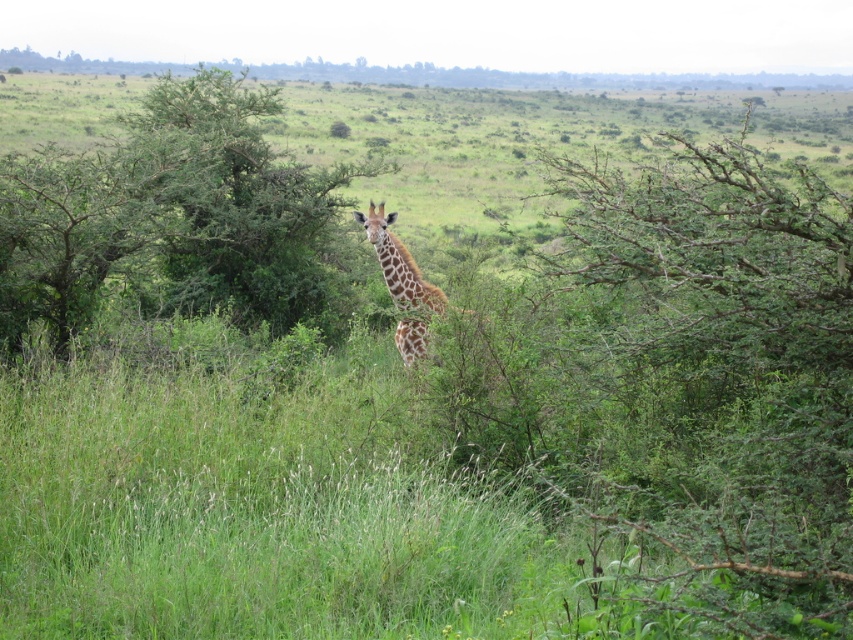
Question: Is green leafy bush at center further to camera compared to green leafy tree at center?

Choices:
 (A) yes
 (B) no

Answer: (B)

Question: Which object is positioned farthest from the green leafy tree at center?

Choices:
 (A) green leafy bush at center
 (B) spotted fur giraffe at center

Answer: (A)

Question: Is green leafy bush at center above spotted fur giraffe at center?

Choices:
 (A) yes
 (B) no

Answer: (A)

Question: Which is nearer to the green leafy bush at center?

Choices:
 (A) spotted fur giraffe at center
 (B) green leafy tree at center

Answer: (A)

Question: Does green leafy tree at center appear on the right side of spotted fur giraffe at center?

Choices:
 (A) yes
 (B) no

Answer: (B)

Question: Which object appears closest to the camera in this image?

Choices:
 (A) green leafy bush at center
 (B) spotted fur giraffe at center

Answer: (A)